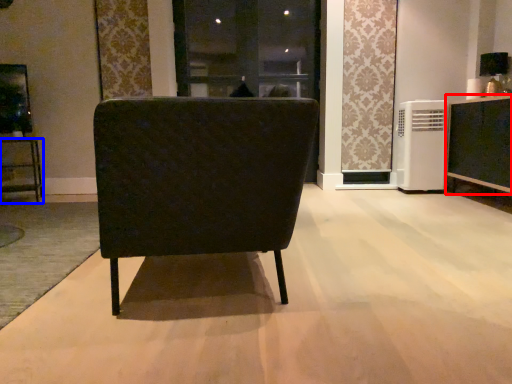
Question: Among these objects, which one is farthest to the camera, cabinetry (highlighted by a red box) or furniture (highlighted by a blue box)?

Choices:
 (A) cabinetry
 (B) furniture

Answer: (B)